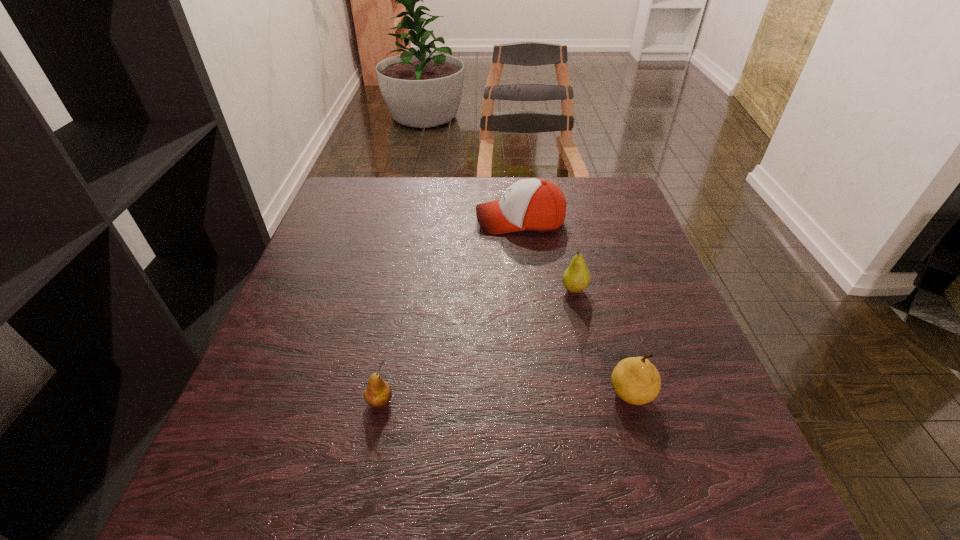
Locate an element on the screen. This screenshot has width=960, height=540. object positioned at the right edge is located at coordinates (636, 380).

Identify the location of vacant space at the far edge of the desktop. This screenshot has height=540, width=960. (477, 186).

Locate an element on the screen. free region at the near edge is located at coordinates (548, 512).

In the image, there is a desktop. Where is `free space at the left edge`? Image resolution: width=960 pixels, height=540 pixels. free space at the left edge is located at coordinates (316, 299).

Find the location of a particular element. The width and height of the screenshot is (960, 540). vacant space at the right edge of the desktop is located at coordinates (624, 317).

In the image, there is a desktop. Find the location of `vacant space at the far left corner`. vacant space at the far left corner is located at coordinates (358, 201).

The width and height of the screenshot is (960, 540). I want to click on empty space between the baseball cap and the leftmost pear, so click(450, 311).

Where is `free spot between the farthest object and the leftmost pear`? free spot between the farthest object and the leftmost pear is located at coordinates (450, 311).

Where is `free space between the farthest object and the leftmost object`? free space between the farthest object and the leftmost object is located at coordinates (450, 311).

Where is `free space between the second farthest object and the leftmost object`? free space between the second farthest object and the leftmost object is located at coordinates (477, 346).